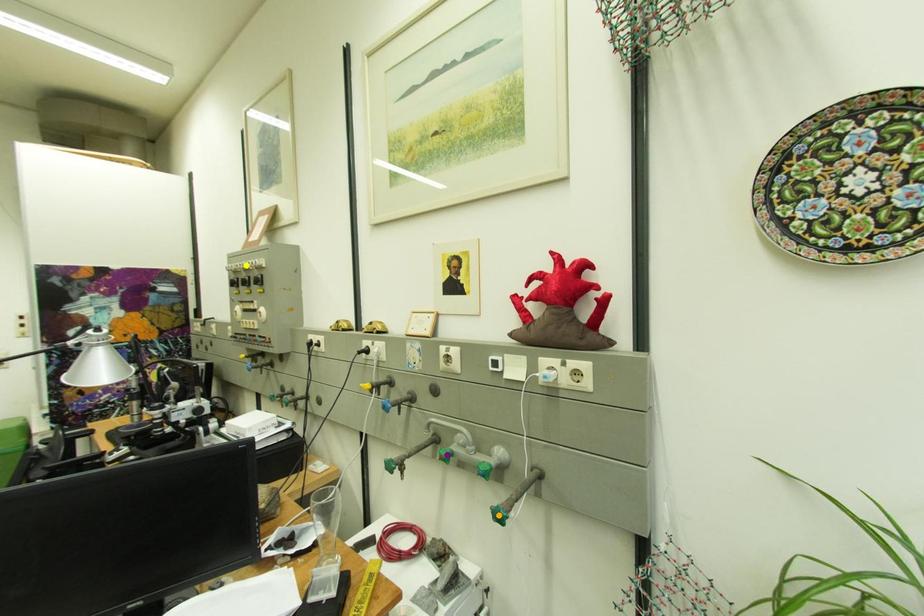
Order these from nearest to farthest:
- yellow point
- orange point
- purple point

orange point
purple point
yellow point